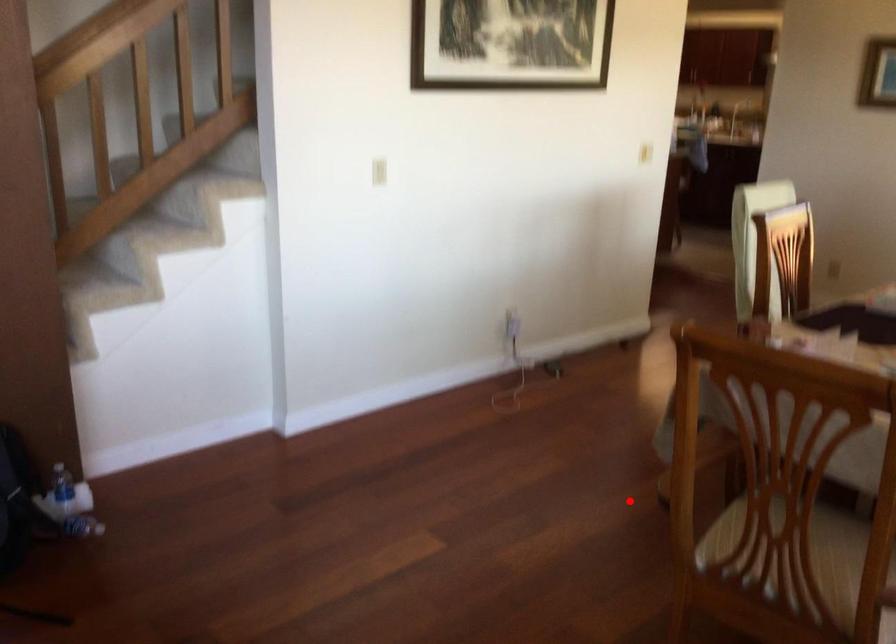
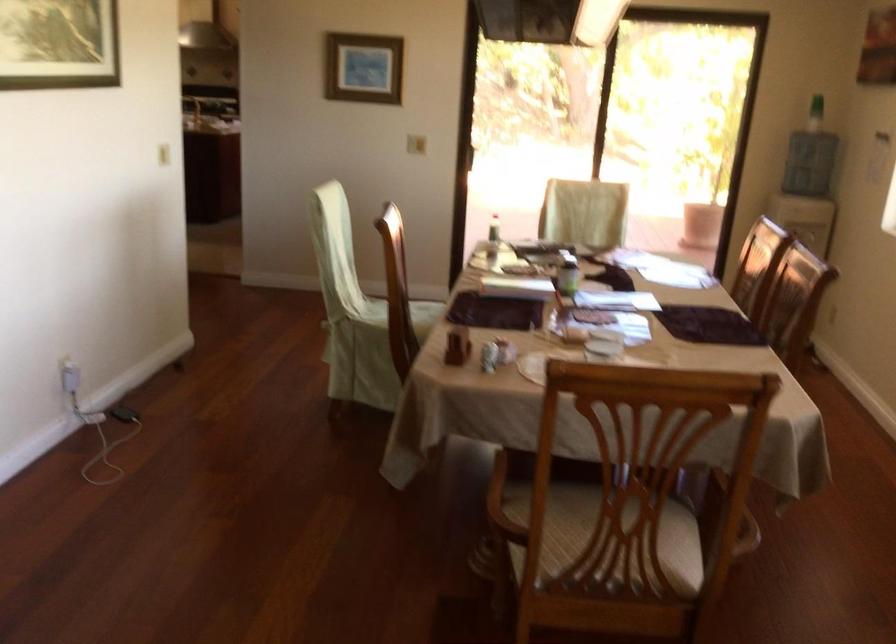
Where in the second image is the point corresponding to the highlighted location from the first image?

(316, 540)